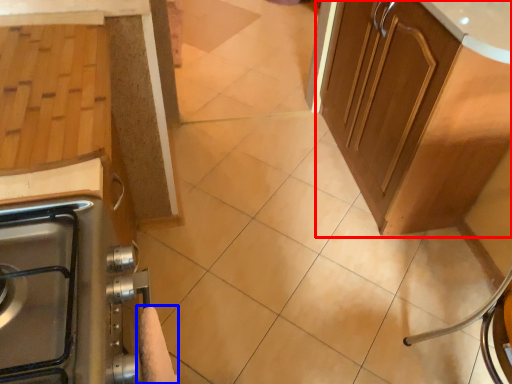
Question: Which object appears farthest to the camera in this image, cabinetry (highlighted by a red box) or hand towel (highlighted by a blue box)?

Choices:
 (A) cabinetry
 (B) hand towel

Answer: (A)